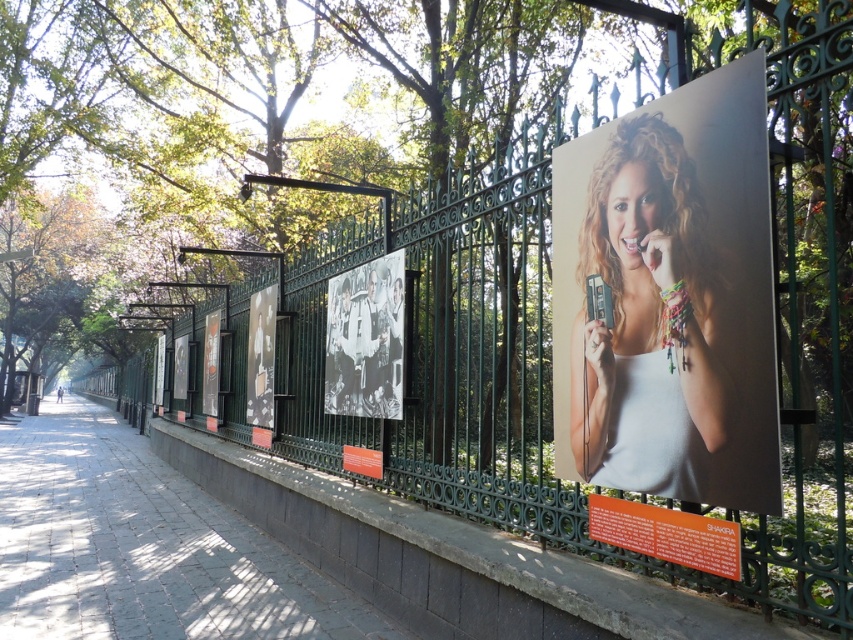
Question: Does black and white photo of people at center have a smaller size compared to black glossy photo frame at center?

Choices:
 (A) yes
 (B) no

Answer: (A)

Question: Among these points, which one is nearest to the camera?

Choices:
 (A) (663, 403)
 (B) (381, 337)
 (C) (102, 452)
 (D) (258, 317)

Answer: (A)

Question: Observing the image, what is the correct spatial positioning of paved stone sidewalk at center in reference to black glossy photo frame at center?

Choices:
 (A) left
 (B) right

Answer: (A)

Question: Is paved stone sidewalk at center wider than black and white photo of people at center?

Choices:
 (A) no
 (B) yes

Answer: (B)

Question: Based on their relative distances, which object is farther from the paved stone sidewalk at center?

Choices:
 (A) black and white photo of people at center
 (B) matte white tank top at center

Answer: (B)

Question: Which point appears closest to the camera in this image?

Choices:
 (A) (679, 246)
 (B) (398, 260)
 (C) (15, 593)
 (D) (271, 396)

Answer: (A)